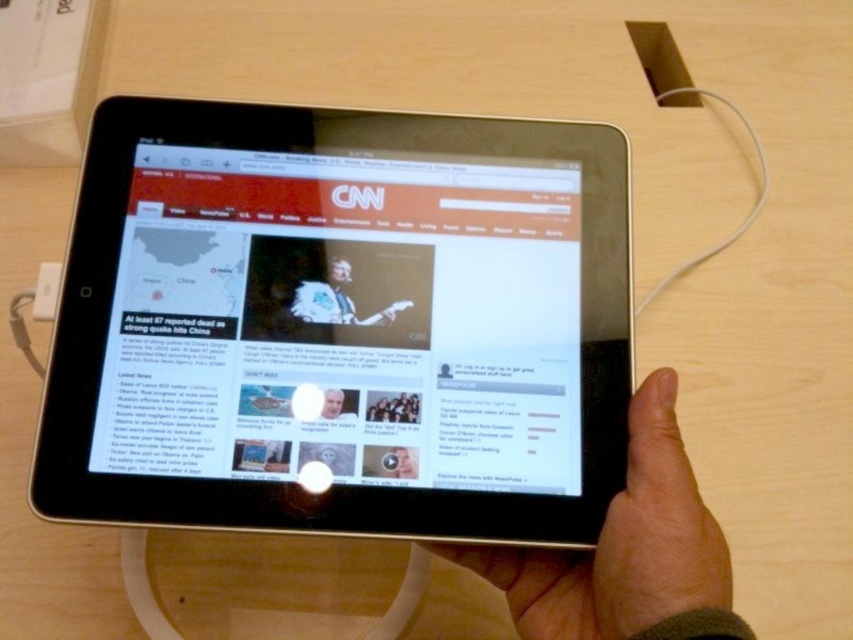
Can you confirm if silver metallic tablet at center is positioned to the left of smooth skin hand at lower right?

Yes, silver metallic tablet at center is to the left of smooth skin hand at lower right.

Is silver metallic tablet at center closer to camera compared to smooth skin hand at lower right?

That is False.

The image size is (853, 640). In order to click on silver metallic tablet at center in this screenshot , I will do tap(341, 324).